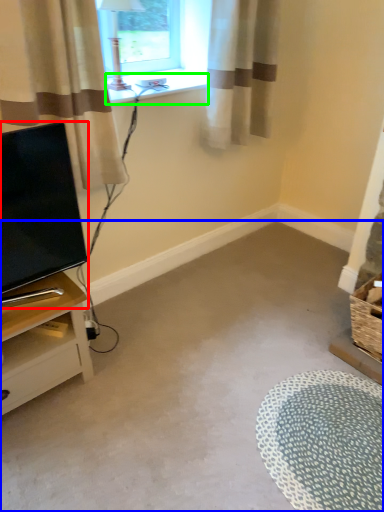
Question: Estimate the real-world distances between objects in this image. Which object is closer to television (highlighted by a red box), plain (highlighted by a blue box) or window sill (highlighted by a green box)?

Choices:
 (A) plain
 (B) window sill

Answer: (B)